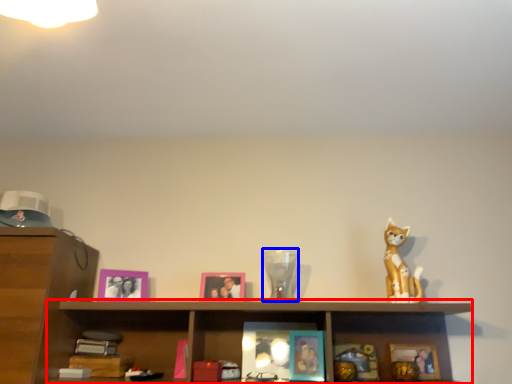
Question: Which point is closer to the camera, cabinet (highlighted by a red box) or glass vase (highlighted by a blue box)?

Choices:
 (A) cabinet
 (B) glass vase

Answer: (A)